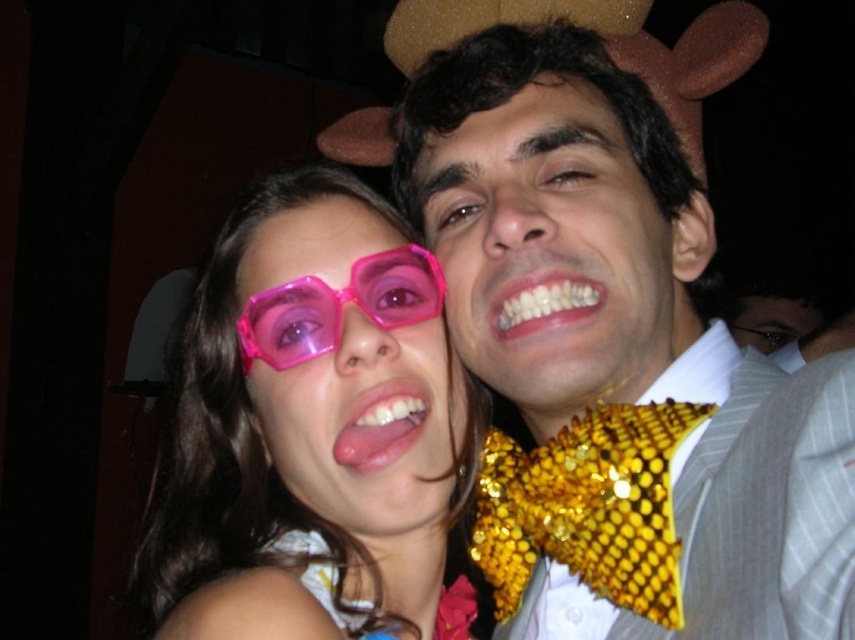
Does shiny gold bow tie at center come in front of pink shiny goggles at center?

That is True.

Based on the photo, is the position of shiny gold bow tie at center more distant than that of pink shiny goggles at center?

No, it is not.

Find the location of a particular element. The width and height of the screenshot is (855, 640). shiny gold bow tie at center is located at coordinates (552, 250).

Can you confirm if pink plastic glasses at center is shorter than pink shiny goggles at center?

Incorrect, pink plastic glasses at center's height does not fall short of pink shiny goggles at center's.

Is pink plastic glasses at center to the right of pink shiny goggles at center from the viewer's perspective?

Incorrect, pink plastic glasses at center is not on the right side of pink shiny goggles at center.

Is point (295, 291) positioned after point (437, 307)?

No, (295, 291) is in front of (437, 307).

Locate an element on the screen. pink plastic glasses at center is located at coordinates (355, 374).

Which is more to the left, transparent plastic glasses at upper center or pink plastic glasses at center?

transparent plastic glasses at upper center is more to the left.

Between transparent plastic glasses at upper center and pink plastic glasses at center, which one is positioned higher?

pink plastic glasses at center is higher up.

Locate an element on the screen. This screenshot has width=855, height=640. transparent plastic glasses at upper center is located at coordinates (311, 428).